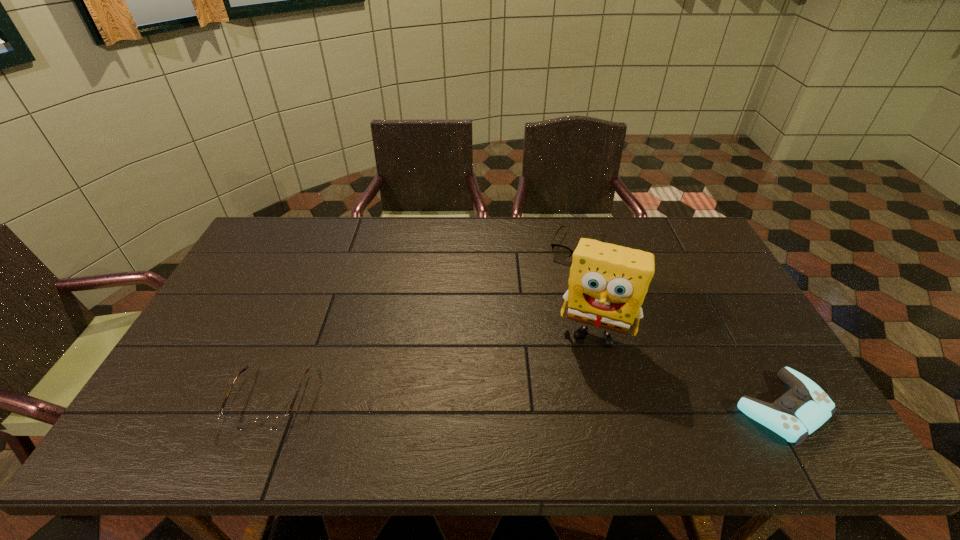
I want to click on the leftmost object, so click(272, 422).

In order to click on the left spectacles in this screenshot , I will do `click(272, 422)`.

This screenshot has width=960, height=540. Identify the location of the rightmost object. (800, 411).

Locate an element on the screen. This screenshot has height=540, width=960. the farther spectacles is located at coordinates (561, 252).

Identify the location of the right spectacles. (561, 252).

At what (x,y) coordinates should I click in order to perform the action: click on sponge. Please return your answer as a coordinate pair (x, y). Image resolution: width=960 pixels, height=540 pixels. Looking at the image, I should click on (607, 284).

At what (x,y) coordinates should I click in order to perform the action: click on the third nearest object. Please return your answer as a coordinate pair (x, y). The image size is (960, 540). Looking at the image, I should click on (607, 284).

I want to click on vacant space positioned on the left of the rightmost object, so click(695, 408).

Locate an element on the screen. This screenshot has height=540, width=960. free space located 0.230m on the face of the farther spectacles is located at coordinates (552, 314).

Locate an element on the screen. This screenshot has width=960, height=540. vacant point located on the face of the farther spectacles is located at coordinates (562, 290).